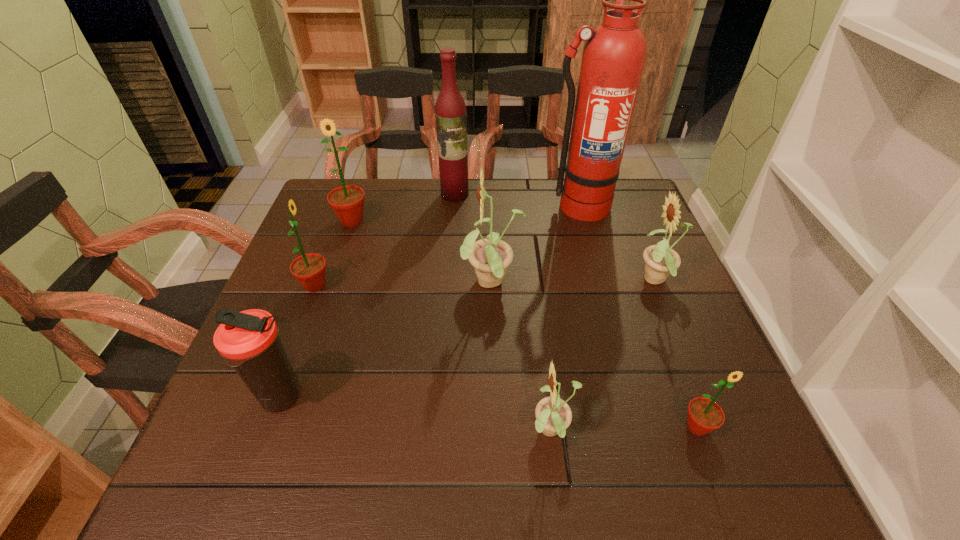
Where is `vacant area between the second farthest green sunflower and the nearest yellow sunflower`? The width and height of the screenshot is (960, 540). vacant area between the second farthest green sunflower and the nearest yellow sunflower is located at coordinates (434, 359).

The image size is (960, 540). What are the coordinates of `empty space between the liquor and the tallest object` in the screenshot? It's located at (516, 200).

Locate an element on the screen. free space between the second smallest green sunflower and the nearest yellow sunflower is located at coordinates (434, 359).

You are a GUI agent. You are given a task and a screenshot of the screen. Output one action in this format:
    pyautogui.click(x=<x>, y=<y>)
    Task: Click on the free space between the rightmost green sunflower and the farthest green sunflower
    This screenshot has height=540, width=960.
    Given the screenshot: What is the action you would take?
    pyautogui.click(x=524, y=324)

Where is `vacant space that is in between the smallest green sunflower and the biggest yellow sunflower`? The image size is (960, 540). vacant space that is in between the smallest green sunflower and the biggest yellow sunflower is located at coordinates (595, 355).

Identify the location of empty location between the thermos bottle and the tallest object. (430, 302).

You are a GUI agent. You are given a task and a screenshot of the screen. Output one action in this format:
    pyautogui.click(x=<x>, y=<y>)
    Task: Click on the vacant space that is in between the biggest yellow sunflower and the second farthest green sunflower
    This screenshot has height=540, width=960.
    Given the screenshot: What is the action you would take?
    pyautogui.click(x=404, y=285)

Select which object appears as the fifth closest to the second smallest green sunflower. Please provide its 2D coordinates. Your answer should be formatted as a tuple, i.e. [(x, y)], where the tuple contains the x and y coordinates of a point satisfying the conditions above.

[(553, 415)]

Find the location of `the sixth closest object relative to the biggest green sunflower`. the sixth closest object relative to the biggest green sunflower is located at coordinates (553, 415).

You are a GUI agent. You are given a task and a screenshot of the screen. Output one action in this format:
    pyautogui.click(x=<x>, y=<y>)
    Task: Click on the third closest sunflower to the second farthest green sunflower
    The width and height of the screenshot is (960, 540).
    Given the screenshot: What is the action you would take?
    pyautogui.click(x=553, y=415)